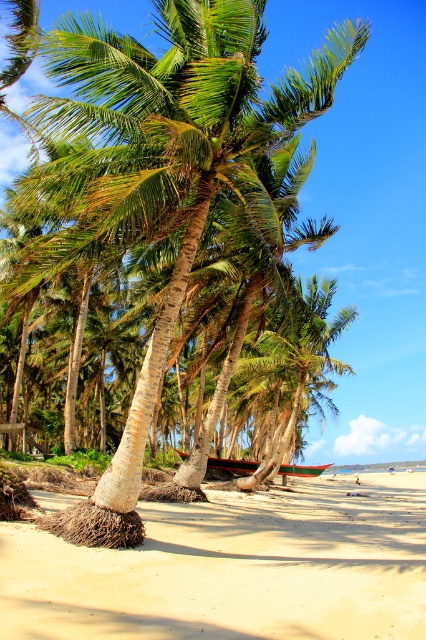
Question: Can you confirm if sandy beach at lower center is positioned to the right of green textured palm tree at center?

Choices:
 (A) yes
 (B) no

Answer: (A)

Question: Which point is closer to the camera?

Choices:
 (A) (319, 470)
 (B) (150, 68)

Answer: (B)

Question: Which point is farther from the camera taking this photo?

Choices:
 (A) (330, 465)
 (B) (83, 621)

Answer: (A)

Question: Which of the following is the closest to the observer?

Choices:
 (A) (170, 88)
 (B) (236, 627)

Answer: (B)

Question: Is green textured palm tree at center to the left of wooden canoe at center from the viewer's perspective?

Choices:
 (A) no
 (B) yes

Answer: (B)

Question: Can you confirm if sandy beach at lower center is wider than green textured palm tree at center?

Choices:
 (A) no
 (B) yes

Answer: (B)